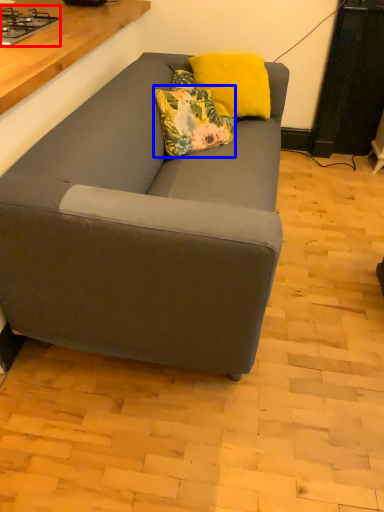
Question: Which point is closer to the camera, gas stove (highlighted by a red box) or pillow (highlighted by a blue box)?

Choices:
 (A) gas stove
 (B) pillow

Answer: (A)